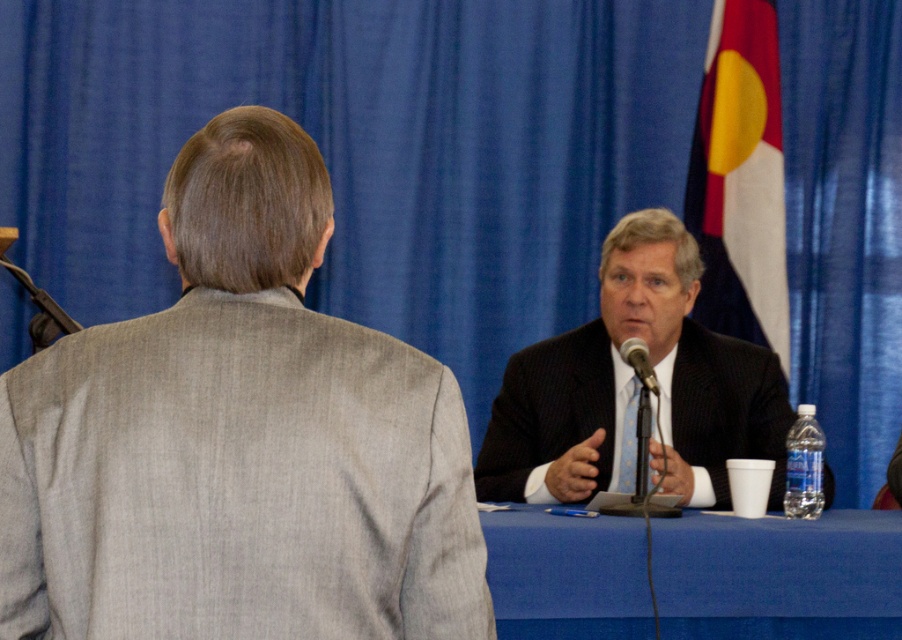
Does gray textured suit at upper left appear on the right side of dark suit at center?

In fact, gray textured suit at upper left is to the left of dark suit at center.

Between gray textured suit at upper left and dark suit at center, which one is positioned lower?

gray textured suit at upper left

The height and width of the screenshot is (640, 902). Identify the location of gray textured suit at upper left. (238, 440).

The image size is (902, 640). What are the coordinates of `gray textured suit at upper left` in the screenshot? It's located at (238, 440).

Does point (45, 376) come behind point (703, 193)?

That is False.

Is gray textured suit at upper left wider than white fabric flag at upper right?

Correct, the width of gray textured suit at upper left exceeds that of white fabric flag at upper right.

Where is `gray textured suit at upper left`? The height and width of the screenshot is (640, 902). gray textured suit at upper left is located at coordinates (238, 440).

Is blue fabric table at center to the left of metallic silver microphone at center from the viewer's perspective?

Incorrect, blue fabric table at center is not on the left side of metallic silver microphone at center.

Between blue fabric table at center and metallic silver microphone at center, which one appears on the right side from the viewer's perspective?

Positioned to the right is blue fabric table at center.

What are the coordinates of `blue fabric table at center` in the screenshot? It's located at (779, 576).